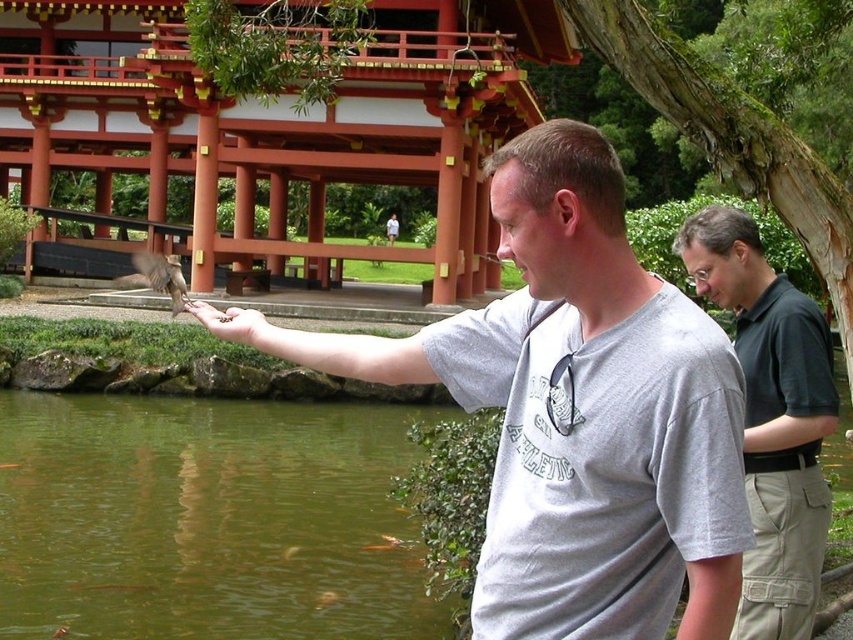
Which is in front, point (274, 608) or point (786, 572)?

Positioned in front is point (786, 572).

Can you confirm if green liquid water at lower left is positioned to the right of dark green polo shirt at right?

Incorrect, green liquid water at lower left is not on the right side of dark green polo shirt at right.

Does point (125, 596) come farther from viewer compared to point (784, 570)?

Yes, it is.

What are the coordinates of `green liquid water at lower left` in the screenshot? It's located at (207, 518).

Does gray matte shirt at center lie behind green liquid water at lower left?

No, it is not.

Does gray matte shirt at center have a larger size compared to green liquid water at lower left?

Actually, gray matte shirt at center might be smaller than green liquid water at lower left.

Is point (703, 628) farther from camera compared to point (26, 576)?

No, it is not.

This screenshot has height=640, width=853. I want to click on gray matte shirt at center, so click(x=575, y=410).

Is point (596, 236) less distant than point (741, 244)?

That is True.

Is point (287, 342) farther from camera compared to point (776, 627)?

That is False.

The image size is (853, 640). Identify the location of gray matte shirt at center. (575, 410).